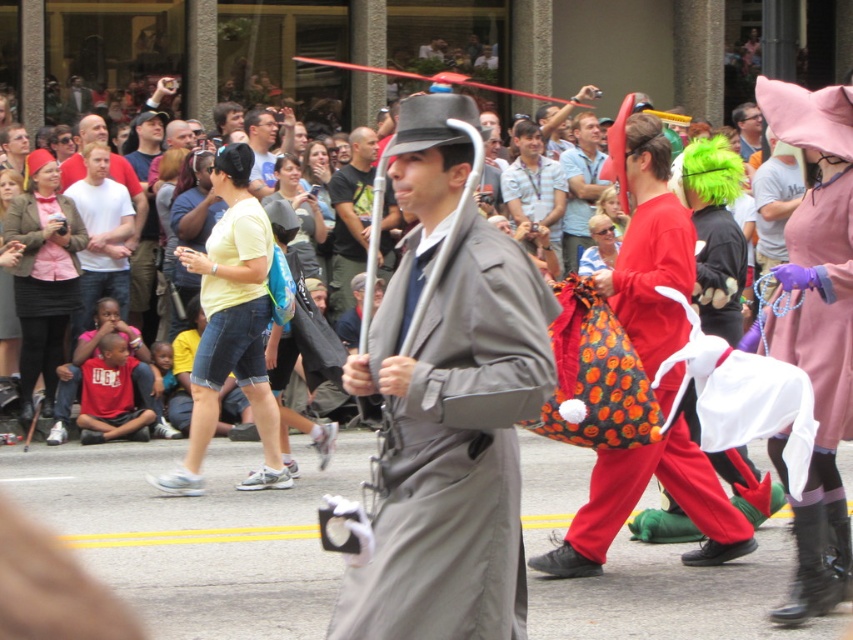
Between matte gray coat at center and matte orange bag at center, which one appears on the right side from the viewer's perspective?

Positioned to the right is matte orange bag at center.

Which is behind, point (451, 269) or point (595, 186)?

Positioned behind is point (595, 186).

Is point (550, 387) closer to camera compared to point (590, 182)?

That is True.

Where is `matte gray coat at center`? matte gray coat at center is located at coordinates (448, 406).

Which is behind, point (97, 282) or point (572, 246)?

Point (572, 246)

Where is `white cotton shirt at left`? white cotton shirt at left is located at coordinates (102, 236).

Locate an element on the screen. The height and width of the screenshot is (640, 853). white cotton shirt at left is located at coordinates (102, 236).

Is point (564, 264) in front of point (251, 116)?

Yes, point (564, 264) is in front of point (251, 116).

Which of these two, matte orange bag at center or matte black shirt at center, stands shorter?

With less height is matte black shirt at center.

Identify the location of matte orange bag at center. (579, 186).

Find the location of a particular element. matte orange bag at center is located at coordinates (579, 186).